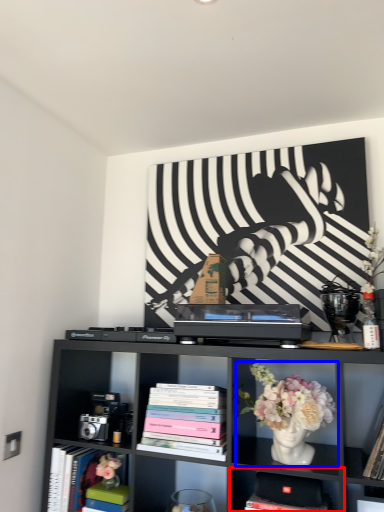
Question: Which of the following is the closest to the observer, shelf (highlighted by a red box) or floral arrangement (highlighted by a blue box)?

Choices:
 (A) shelf
 (B) floral arrangement

Answer: (B)